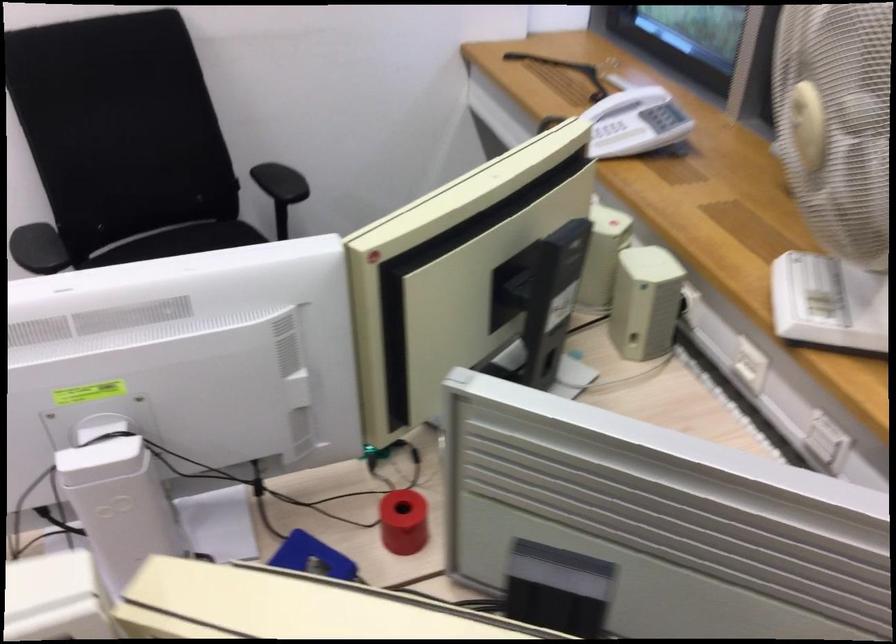
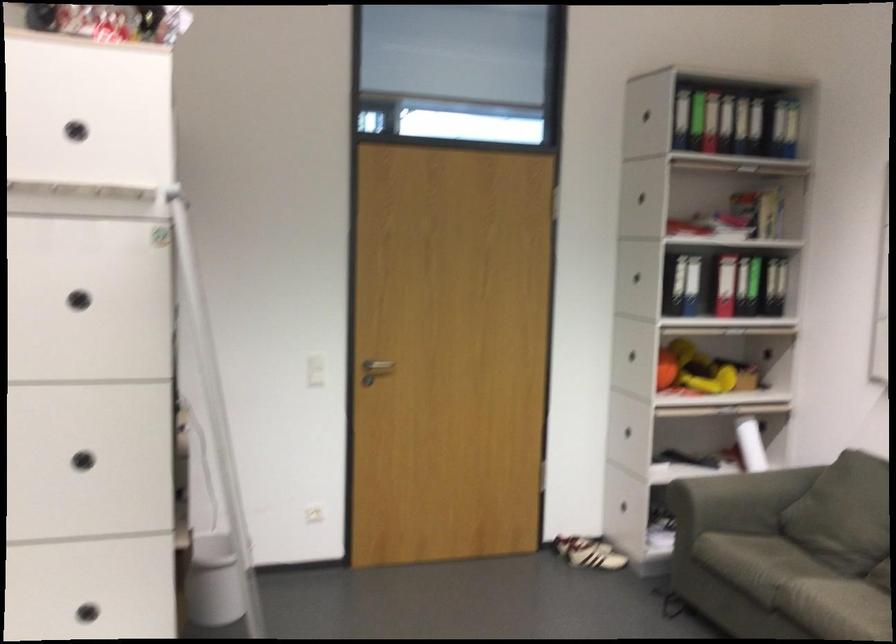
Question: Based on the continuous images, in which direction is the camera rotating? Reply with the corresponding letter.

Choices:
 (A) Left
 (B) Right
 (C) Up
 (D) Down

Answer: (A)